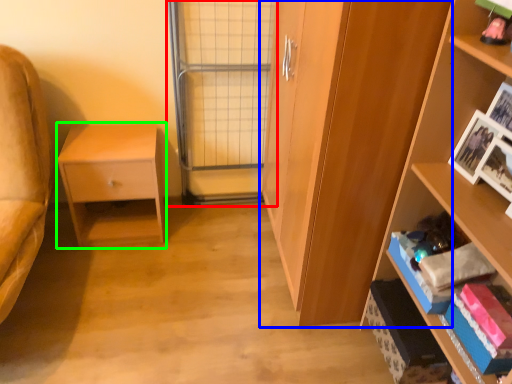
Question: Which object is the closest to the screen door (highlighted by a red box)? Choose among these: cabinetry (highlighted by a blue box) or nightstand (highlighted by a green box).

Choices:
 (A) cabinetry
 (B) nightstand

Answer: (B)